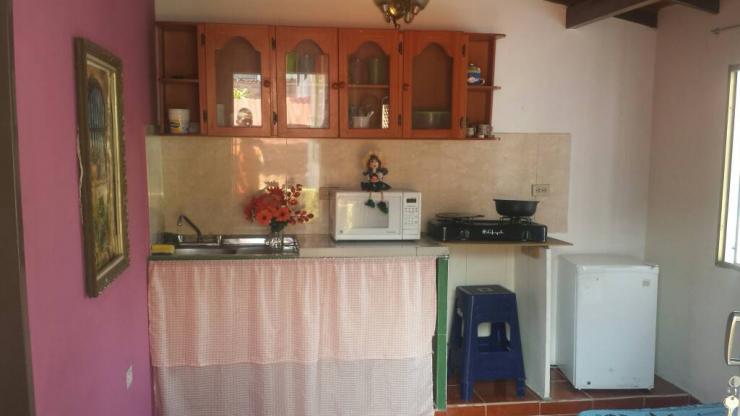
At what (x,y) coordinates should I click in order to perform the action: click on frame. Please return your answer as a coordinate pair (x, y). The image size is (740, 416). Looking at the image, I should click on (103, 161).